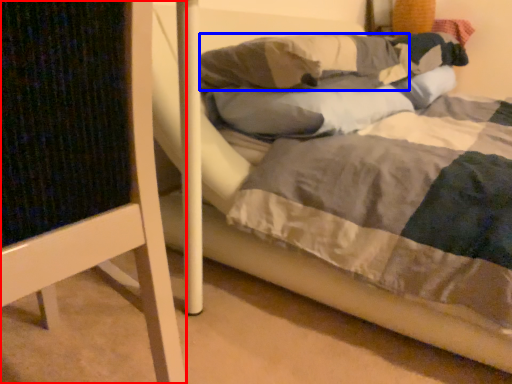
Question: Which object appears farthest to the camera in this image, furniture (highlighted by a red box) or pillow (highlighted by a blue box)?

Choices:
 (A) furniture
 (B) pillow

Answer: (B)